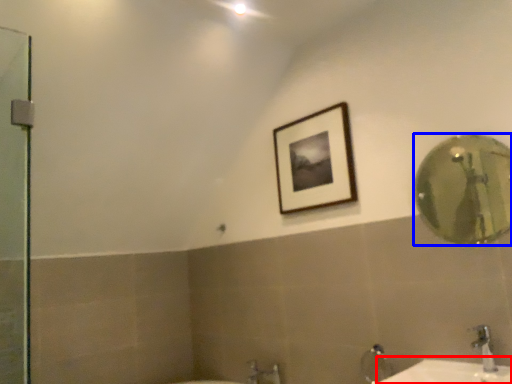
Question: Among these objects, which one is nearest to the camera, counter top (highlighted by a red box) or mirror (highlighted by a blue box)?

Choices:
 (A) counter top
 (B) mirror

Answer: (A)